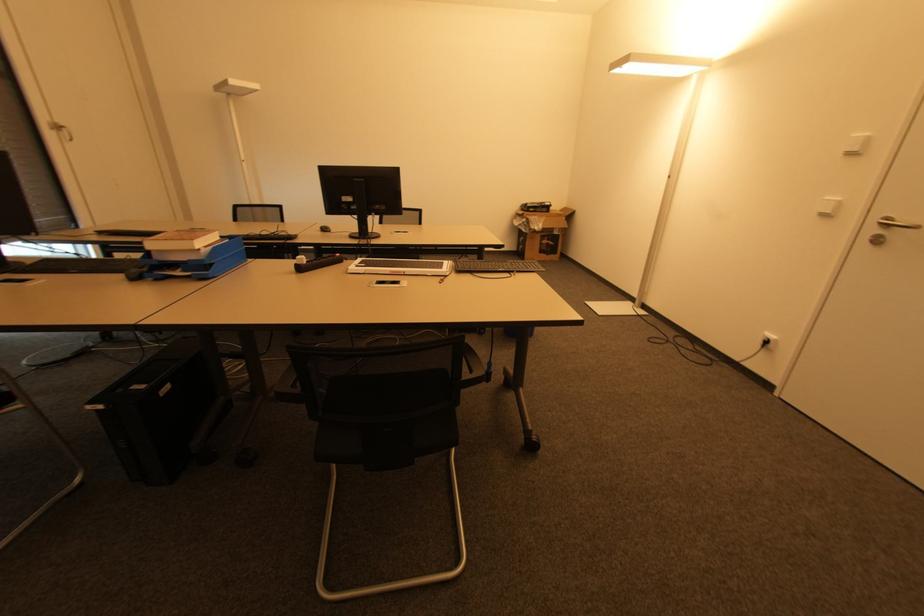
Image resolution: width=924 pixels, height=616 pixels. Describe the element at coordinates (78, 265) in the screenshot. I see `the black keyboard` at that location.